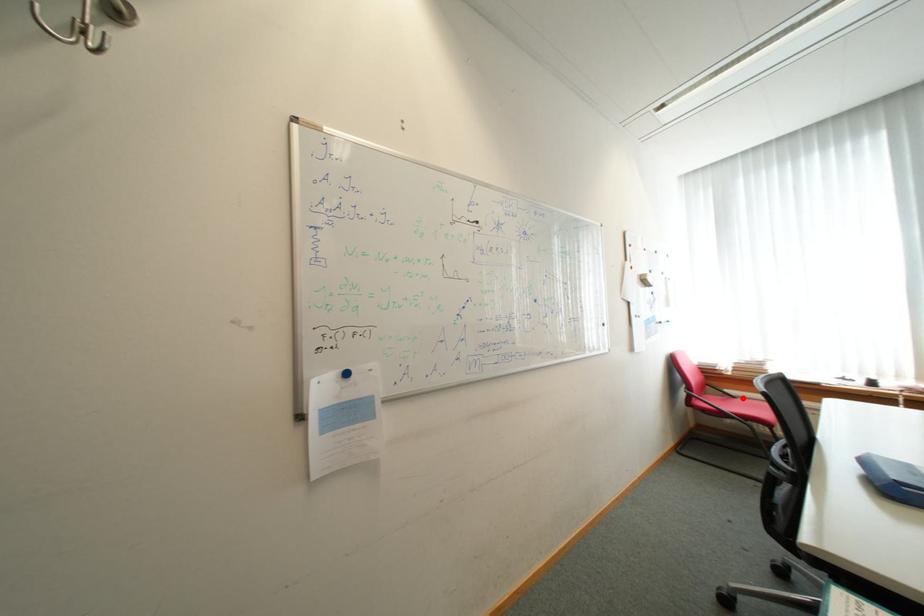
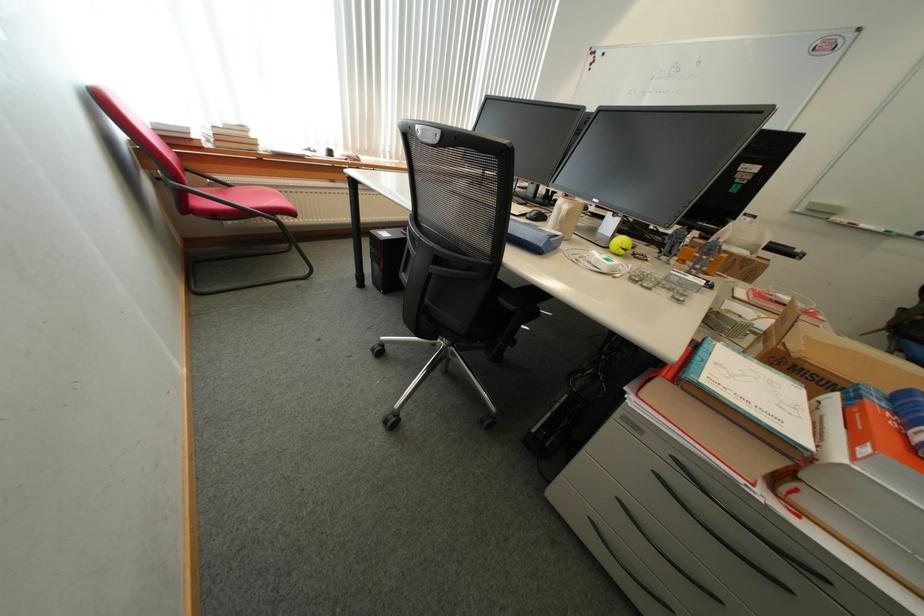
In the second image, find the point that corresponds to the highlighted location in the first image.

(237, 187)